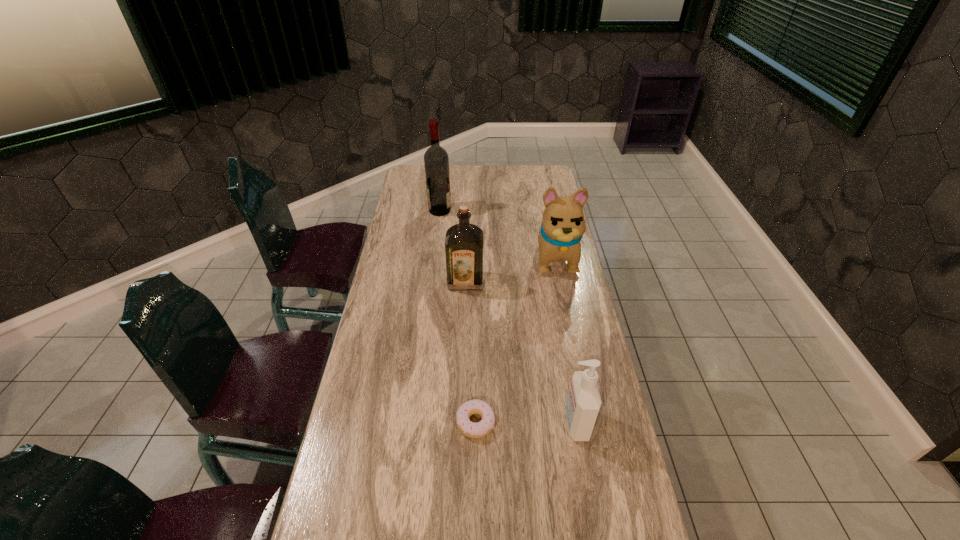
Locate an element on the screen. The width and height of the screenshot is (960, 540). the farthest object is located at coordinates (436, 161).

In order to click on the leftmost object in this screenshot , I will do `click(436, 161)`.

Where is `puppy`? This screenshot has width=960, height=540. puppy is located at coordinates (563, 225).

Find the location of a particular element. This screenshot has height=540, width=960. liquor is located at coordinates (464, 243).

Where is `the fourth tallest object`? This screenshot has width=960, height=540. the fourth tallest object is located at coordinates (583, 404).

Where is `the shortest object`? the shortest object is located at coordinates pos(470,429).

This screenshot has width=960, height=540. In order to click on vacant space located 0.220m on the front and back of the tallest object in this screenshot , I will do click(501, 211).

In order to click on vacant space located on the face of the puppy in this screenshot , I will do [565, 309].

You are a GUI agent. You are given a task and a screenshot of the screen. Output one action in this format:
    pyautogui.click(x=<x>, y=<y>)
    Task: Click on the free space located 0.280m on the label of the liquor
    
    Given the screenshot: What is the action you would take?
    pyautogui.click(x=464, y=354)

Identify the location of free space located on the front label of the cleansing agent. (505, 423).